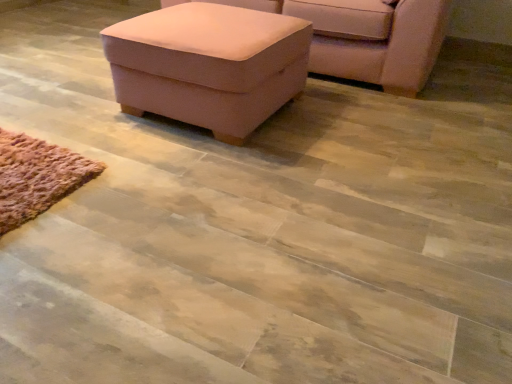
Where is `pink fabric ottoman at upper center`? The image size is (512, 384). pink fabric ottoman at upper center is located at coordinates (208, 65).

The height and width of the screenshot is (384, 512). What do you see at coordinates (208, 65) in the screenshot?
I see `pink fabric ottoman at upper center` at bounding box center [208, 65].

What do you see at coordinates (366, 37) in the screenshot? The height and width of the screenshot is (384, 512). I see `suede-like pink ottoman at upper center` at bounding box center [366, 37].

Locate an element on the screen. suede-like pink ottoman at upper center is located at coordinates (366, 37).

Where is `pink fabric ottoman at upper center`? pink fabric ottoman at upper center is located at coordinates coord(208,65).

Is suede-like pink ottoman at upper center to the left of pink fabric ottoman at upper center from the viewer's perspective?

No.

In the image, is suede-like pink ottoman at upper center positioned in front of or behind pink fabric ottoman at upper center?

In the image, suede-like pink ottoman at upper center appears behind pink fabric ottoman at upper center.

Is point (424, 16) farther from camera compared to point (304, 57)?

Yes, point (424, 16) is behind point (304, 57).

From the image's perspective, is suede-like pink ottoman at upper center located beneath pink fabric ottoman at upper center?

No.

From a real-world perspective, is suede-like pink ottoman at upper center located higher than pink fabric ottoman at upper center?

Indeed, from a real-world perspective, suede-like pink ottoman at upper center stands above pink fabric ottoman at upper center.

Looking at their sizes, would you say suede-like pink ottoman at upper center is wider or thinner than pink fabric ottoman at upper center?

Considering their sizes, suede-like pink ottoman at upper center looks broader than pink fabric ottoman at upper center.

Is suede-like pink ottoman at upper center taller than pink fabric ottoman at upper center?

Yes.

Between suede-like pink ottoman at upper center and pink fabric ottoman at upper center, which one has larger size?

suede-like pink ottoman at upper center.

Is pink fabric ottoman at upper center surrounded by suede-like pink ottoman at upper center?

Actually, pink fabric ottoman at upper center is outside suede-like pink ottoman at upper center.

Is suede-like pink ottoman at upper center not near pink fabric ottoman at upper center?

No, suede-like pink ottoman at upper center is in close proximity to pink fabric ottoman at upper center.

Is suede-like pink ottoman at upper center turned away from pink fabric ottoman at upper center?

suede-like pink ottoman at upper center does not have its back to pink fabric ottoman at upper center.

How far apart are suede-like pink ottoman at upper center and pink fabric ottoman at upper center?

suede-like pink ottoman at upper center and pink fabric ottoman at upper center are 26.81 inches apart.

Locate an element on the screen. chair above the pink fabric ottoman at upper center (from a real-world perspective) is located at coordinates (366, 37).

Does pink fabric ottoman at upper center appear on the right side of suede-like pink ottoman at upper center?

No.

Is pink fabric ottoman at upper center in front of or behind suede-like pink ottoman at upper center in the image?

In the image, pink fabric ottoman at upper center appears in front of suede-like pink ottoman at upper center.

Which is behind, point (294, 58) or point (389, 44)?

Point (389, 44)

From the image's perspective, is pink fabric ottoman at upper center above or below suede-like pink ottoman at upper center?

Clearly, from the image's perspective, pink fabric ottoman at upper center is below suede-like pink ottoman at upper center.

From a real-world perspective, which object rests below the other?

pink fabric ottoman at upper center is physically lower.

Considering the relative sizes of pink fabric ottoman at upper center and suede-like pink ottoman at upper center in the image provided, is pink fabric ottoman at upper center wider than suede-like pink ottoman at upper center?

In fact, pink fabric ottoman at upper center might be narrower than suede-like pink ottoman at upper center.

In the scene shown: Considering the relative sizes of pink fabric ottoman at upper center and suede-like pink ottoman at upper center in the image provided, is pink fabric ottoman at upper center taller than suede-like pink ottoman at upper center?

Incorrect, the height of pink fabric ottoman at upper center is not larger of that of suede-like pink ottoman at upper center.

Considering the sizes of objects pink fabric ottoman at upper center and suede-like pink ottoman at upper center in the image provided, who is smaller, pink fabric ottoman at upper center or suede-like pink ottoman at upper center?

With smaller size is pink fabric ottoman at upper center.

Is pink fabric ottoman at upper center not inside suede-like pink ottoman at upper center?

Absolutely, pink fabric ottoman at upper center is external to suede-like pink ottoman at upper center.

Is pink fabric ottoman at upper center with suede-like pink ottoman at upper center?

No, pink fabric ottoman at upper center is not touching suede-like pink ottoman at upper center.

Is suede-like pink ottoman at upper center at the back of pink fabric ottoman at upper center?

Correct, pink fabric ottoman at upper center is looking away from suede-like pink ottoman at upper center.

The height and width of the screenshot is (384, 512). I want to click on table in front of the suede-like pink ottoman at upper center, so click(208, 65).

Image resolution: width=512 pixels, height=384 pixels. Identify the location of table located underneath the suede-like pink ottoman at upper center (from a real-world perspective). (208, 65).

Identify the location of chair on the right of pink fabric ottoman at upper center. (366, 37).